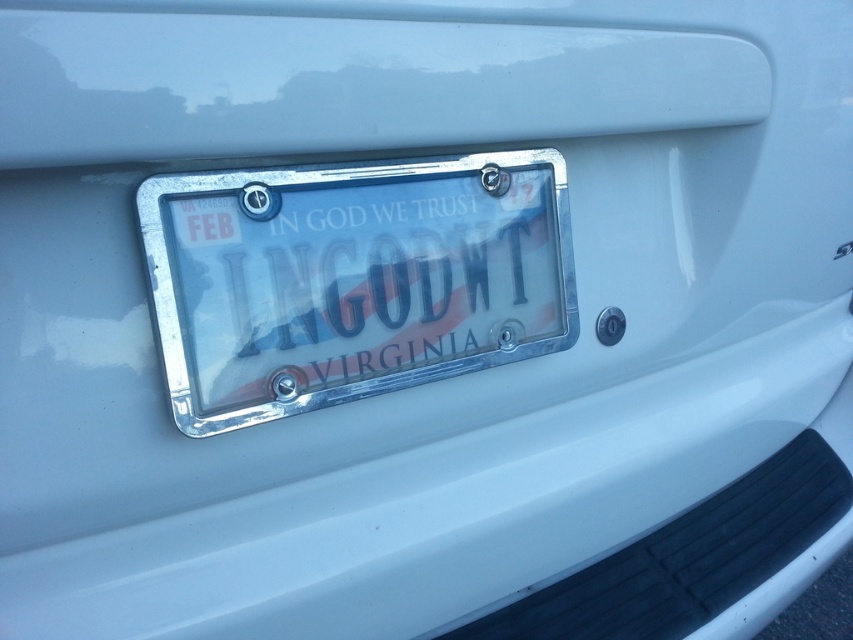
You are designing a sticker to cover the chrome metallic license plate at center and the black glossy text at center. If the sticker must be larger than both to cover them completely, which object should determine the minimum size of the sticker?

The sticker must be larger than the chrome metallic license plate at center since its width is larger than the black glossy text at center.

You are a technician inspecting the license plate. You notice two points on the plate at coordinates point (215, 216) and point (285, 211). Which point is nearer to you?

Point (215, 216) is closer to the viewer than point (285, 211).

You are a photographer standing at a point 28.16 inches away from the point at (312, 246). You want to take a clear photo of the Virginia license plate on the white vehicle. Considering your current position, will you be able to capture the entire license plate in the photo?

The point at (312, 246) is 28.16 inches away from the camera. Since the license plate is mounted on the rear of the white vehicle and the photographer is positioned at that distance, it is possible to capture the entire license plate in the photo as long as the camera has an appropriate focal length and angle to encompass the plate within the frame.